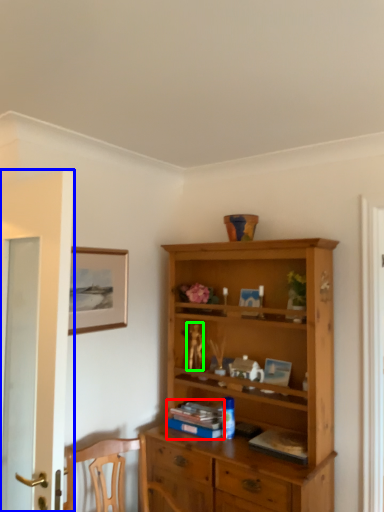
Question: Considering the real-world distances, which object is farthest from book (highlighted by a red box)? door (highlighted by a blue box) or toy (highlighted by a green box)?

Choices:
 (A) door
 (B) toy

Answer: (A)